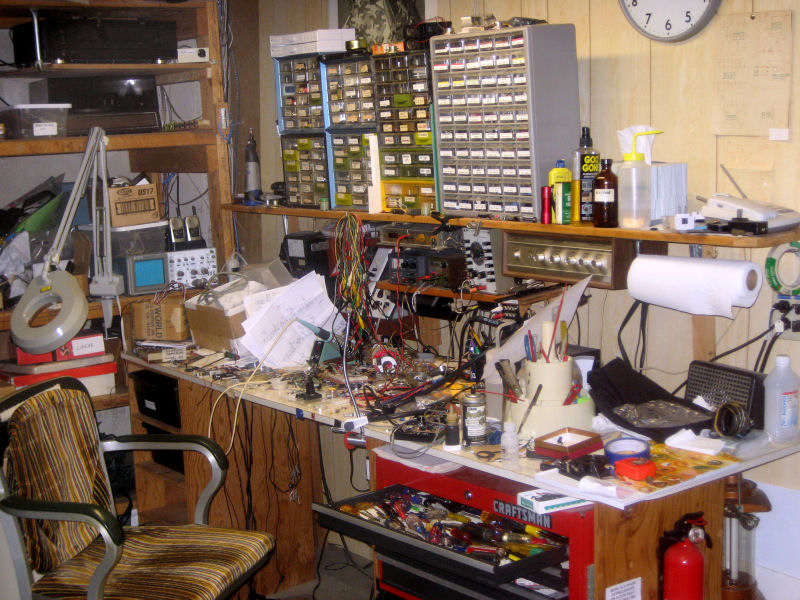
What are the coordinates of `clock` in the screenshot? It's located at click(x=664, y=21).